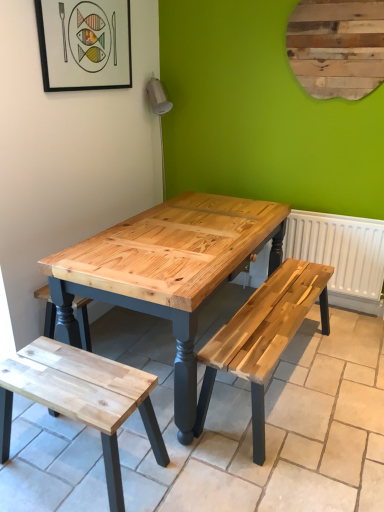
At what (x,y) coordinates should I click in order to perform the action: click on free point in front of white matte radiator at right. Please return your answer as a coordinate pair (x, y). The height and width of the screenshot is (512, 384). Looking at the image, I should click on pos(327,339).